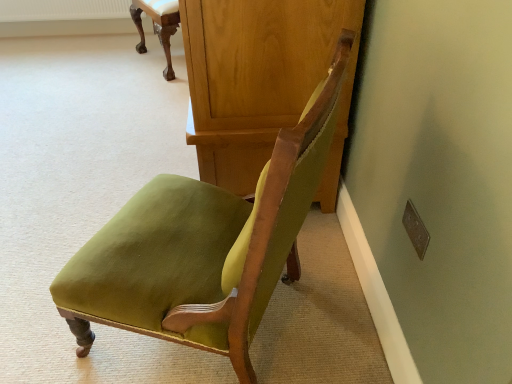
Where is `free spot to the left of velvet green chair at center, the 1th chair when ordered from bottom to top`? free spot to the left of velvet green chair at center, the 1th chair when ordered from bottom to top is located at coordinates (48, 284).